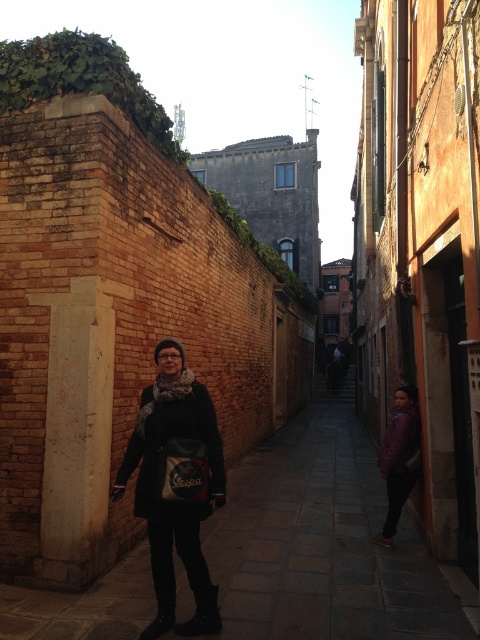
Question: Which object is the farthest from the matte black coat at center?

Choices:
 (A) purple matte jacket at lower right
 (B) dark stone pavement at center

Answer: (A)

Question: Which point is farther to the camera?

Choices:
 (A) purple matte jacket at lower right
 (B) matte black coat at center

Answer: (A)

Question: In this image, where is matte black coat at center located relative to purple matte jacket at lower right?

Choices:
 (A) right
 (B) left

Answer: (B)

Question: Which of the following is the farthest from the observer?

Choices:
 (A) matte black coat at center
 (B) dark stone pavement at center
 (C) purple matte jacket at lower right

Answer: (C)

Question: Is dark stone pavement at center further to the viewer compared to purple matte jacket at lower right?

Choices:
 (A) yes
 (B) no

Answer: (B)

Question: Is matte black coat at center below purple matte jacket at lower right?

Choices:
 (A) no
 (B) yes

Answer: (A)